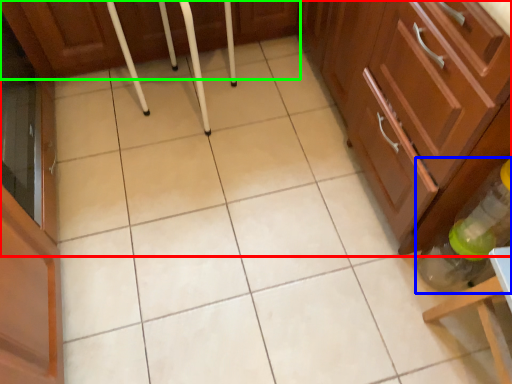
Question: Which object is positioned farthest from cabinetry (highlighted by a red box)? Select from bottle (highlighted by a blue box) and cabinetry (highlighted by a green box).

Choices:
 (A) bottle
 (B) cabinetry

Answer: (B)